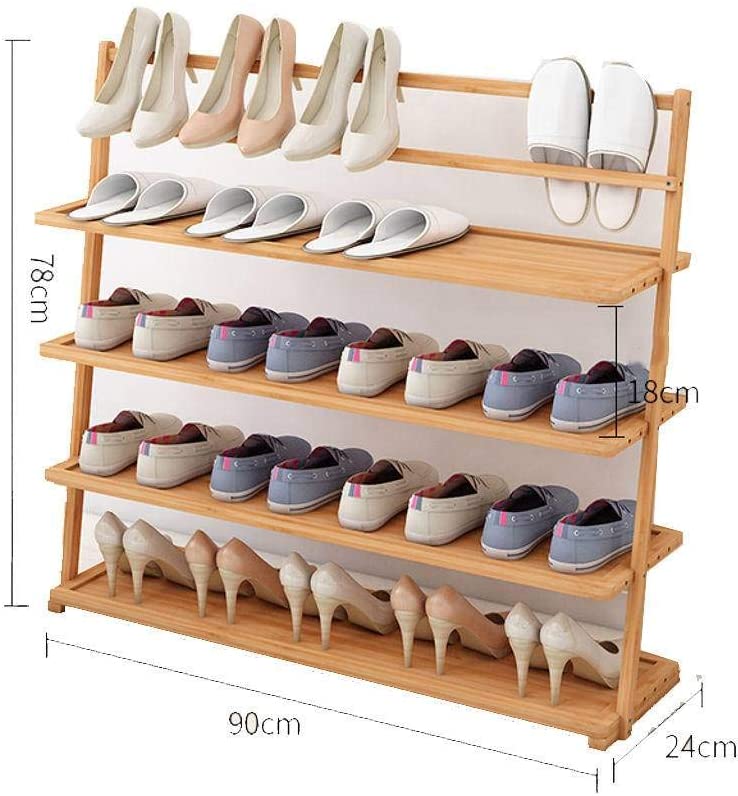
At what (x,y) coordinates should I click in order to perform the action: click on shoes on rack. Please return your answer as a coordinate pair (x, y). Looking at the image, I should click on (123, 82), (144, 98), (207, 116), (268, 139), (365, 149), (525, 143), (606, 135), (327, 127).